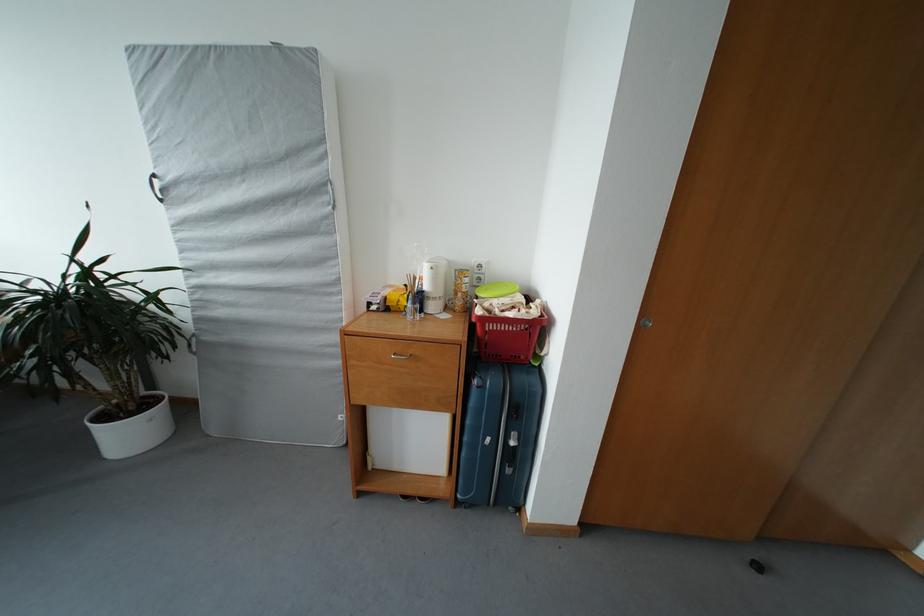
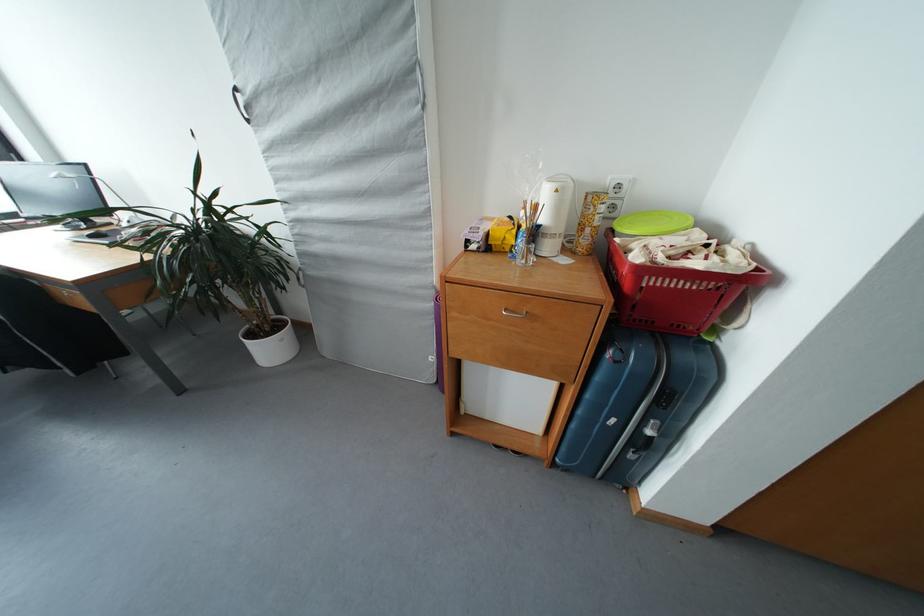
Where in the second image is the point corresponding to (x=114, y=422) from the first image?

(260, 339)